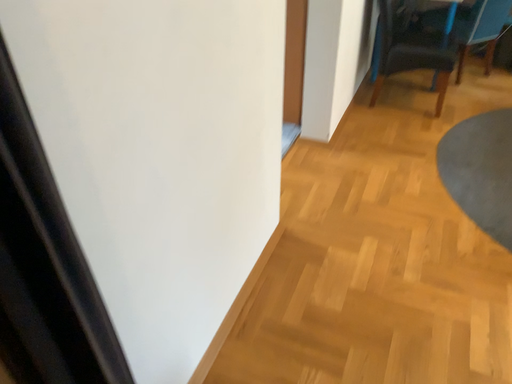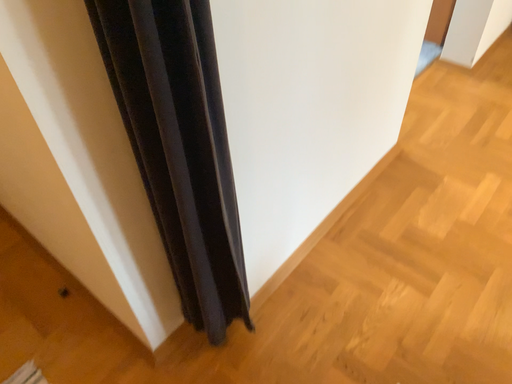
Question: Which way did the camera rotate in the video?

Choices:
 (A) rotated upward
 (B) rotated downward

Answer: (B)